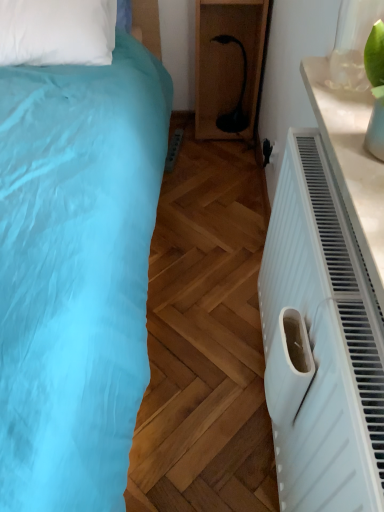
The height and width of the screenshot is (512, 384). I want to click on black plastic lamp at center, so click(x=227, y=62).

In order to face black plastic lamp at center, should I rotate leftwards or rightwards?

Turn right approximately 5.214 degrees to face it.

What do you see at coordinates (227, 62) in the screenshot? Image resolution: width=384 pixels, height=512 pixels. I see `black plastic lamp at center` at bounding box center [227, 62].

Image resolution: width=384 pixels, height=512 pixels. Describe the element at coordinates (267, 151) in the screenshot. I see `white plastic electric outlet at center-right` at that location.

Based on the photo, what is the approximate height of white plastic electric outlet at center-right?

The height of white plastic electric outlet at center-right is 4.92 inches.

This screenshot has height=512, width=384. Find the location of `white plastic electric outlet at center-right`. white plastic electric outlet at center-right is located at coordinates (267, 151).

I want to click on black plastic lamp at center, so click(x=227, y=62).

Considering the positions of objects white plastic electric outlet at center-right and black plastic lamp at center in the image provided, who is more to the right, white plastic electric outlet at center-right or black plastic lamp at center?

Positioned to the right is white plastic electric outlet at center-right.

Relative to black plastic lamp at center, is white plastic electric outlet at center-right in front or behind?

In the image, white plastic electric outlet at center-right appears in front of black plastic lamp at center.

Is point (271, 150) farther from viewer compared to point (216, 111)?

No, it is not.

From the image's perspective, relative to black plastic lamp at center, is white plastic electric outlet at center-right above or below?

Clearly, from the image's perspective, white plastic electric outlet at center-right is below black plastic lamp at center.

From a real-world perspective, between white plastic electric outlet at center-right and black plastic lamp at center, who is vertically higher?

black plastic lamp at center, from a real-world perspective.

Considering the relative sizes of white plastic electric outlet at center-right and black plastic lamp at center in the image provided, is white plastic electric outlet at center-right thinner than black plastic lamp at center?

Correct, the width of white plastic electric outlet at center-right is less than that of black plastic lamp at center.

Can you confirm if white plastic electric outlet at center-right is taller than black plastic lamp at center?

No.

Based on their sizes in the image, would you say white plastic electric outlet at center-right is bigger or smaller than black plastic lamp at center?

Clearly, white plastic electric outlet at center-right is smaller in size than black plastic lamp at center.

Is white plastic electric outlet at center-right located outside black plastic lamp at center?

Yes, white plastic electric outlet at center-right is outside of black plastic lamp at center.

Is white plastic electric outlet at center-right next to black plastic lamp at center and touching it?

white plastic electric outlet at center-right and black plastic lamp at center are not in contact.

Is black plastic lamp at center at the back of white plastic electric outlet at center-right?

No.

Can you tell me how much white plastic electric outlet at center-right and black plastic lamp at center differ in facing direction?

The angle between the facing direction of white plastic electric outlet at center-right and the facing direction of black plastic lamp at center is 90 degrees.

Where is `furniture on the left of white plastic electric outlet at center-right`? The width and height of the screenshot is (384, 512). furniture on the left of white plastic electric outlet at center-right is located at coordinates (227, 62).

Is black plastic lamp at center at the left side of white plastic electric outlet at center-right?

Indeed, black plastic lamp at center is positioned on the left side of white plastic electric outlet at center-right.

Is black plastic lamp at center behind white plastic electric outlet at center-right?

Yes, the depth of black plastic lamp at center is greater than that of white plastic electric outlet at center-right.

Does point (226, 80) appear closer or farther from the camera than point (268, 153)?

Point (226, 80) is positioned farther from the camera compared to point (268, 153).

From the image's perspective, is black plastic lamp at center on white plastic electric outlet at center-right?

Correct, black plastic lamp at center appears higher than white plastic electric outlet at center-right in the image.

In the scene shown: From a real-world perspective, is black plastic lamp at center above or below white plastic electric outlet at center-right?

Answer: Clearly, from a real-world perspective, black plastic lamp at center is above white plastic electric outlet at center-right.

Does black plastic lamp at center have a lesser width compared to white plastic electric outlet at center-right?

No.

Considering the relative sizes of black plastic lamp at center and white plastic electric outlet at center-right in the image provided, is black plastic lamp at center shorter than white plastic electric outlet at center-right?

In fact, black plastic lamp at center may be taller than white plastic electric outlet at center-right.

Which of these two, black plastic lamp at center or white plastic electric outlet at center-right, is smaller?

With smaller size is white plastic electric outlet at center-right.

Is black plastic lamp at center completely or partially outside of white plastic electric outlet at center-right?

black plastic lamp at center is positioned outside white plastic electric outlet at center-right.

Is black plastic lamp at center not near white plastic electric outlet at center-right?

No, black plastic lamp at center is not far away from white plastic electric outlet at center-right.

Is black plastic lamp at center aimed at white plastic electric outlet at center-right?

Yes, black plastic lamp at center is turned towards white plastic electric outlet at center-right.

What's the angular difference between black plastic lamp at center and white plastic electric outlet at center-right's facing directions?

The angular difference between black plastic lamp at center and white plastic electric outlet at center-right is 90 degrees.

The height and width of the screenshot is (512, 384). In order to click on furniture above the white plastic electric outlet at center-right (from a real-world perspective) in this screenshot , I will do `click(227, 62)`.

At what (x,y) coordinates should I click in order to perform the action: click on furniture positioned vertically above the white plastic electric outlet at center-right (from a real-world perspective). Please return your answer as a coordinate pair (x, y). The width and height of the screenshot is (384, 512). Looking at the image, I should click on (227, 62).

I want to click on electric outlet in front of the black plastic lamp at center, so click(267, 151).